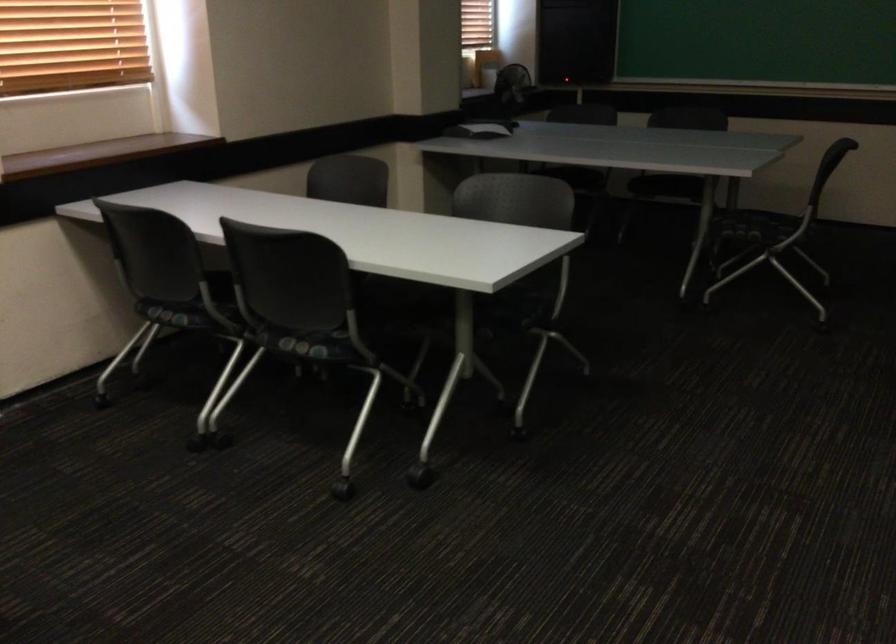
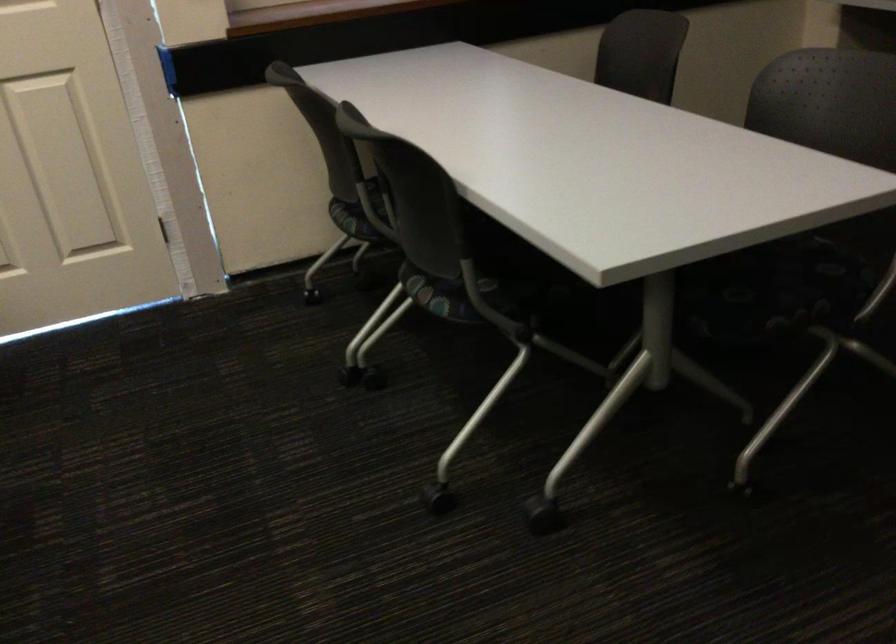
Find the pixel in the second image that matches (176,317) in the first image.

(350, 220)